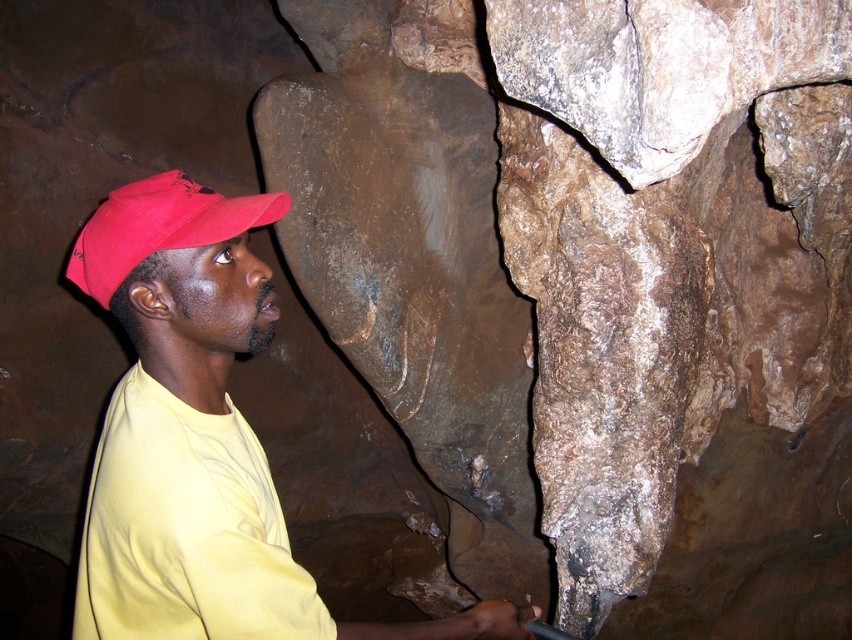
Who is more forward, (x=648, y=35) or (x=168, y=326)?

Point (x=168, y=326)

Between brown rough rock at center and yellow matte shirt at center, which one appears on the left side from the viewer's perspective?

Positioned to the left is yellow matte shirt at center.

Locate an element on the screen. brown rough rock at center is located at coordinates (594, 288).

Is point (288, 90) closer to viewer compared to point (255, 209)?

No, it is not.

Can you confirm if brown rough rock at center is smaller than matte red cap at left?

No.

The width and height of the screenshot is (852, 640). Identify the location of brown rough rock at center. (594, 288).

Between yellow matte shirt at center and matte red cap at left, which one is positioned higher?

Positioned higher is matte red cap at left.

Is point (153, 464) farther from viewer compared to point (217, 234)?

That is False.

This screenshot has height=640, width=852. In order to click on yellow matte shirt at center in this screenshot , I will do click(199, 438).